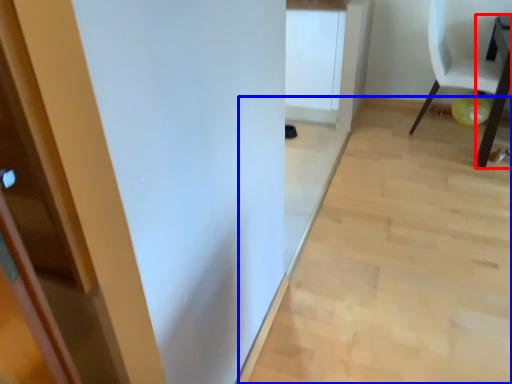
Question: Which object appears closest to the camera in this image, table (highlighted by a red box) or plain (highlighted by a blue box)?

Choices:
 (A) table
 (B) plain

Answer: (B)